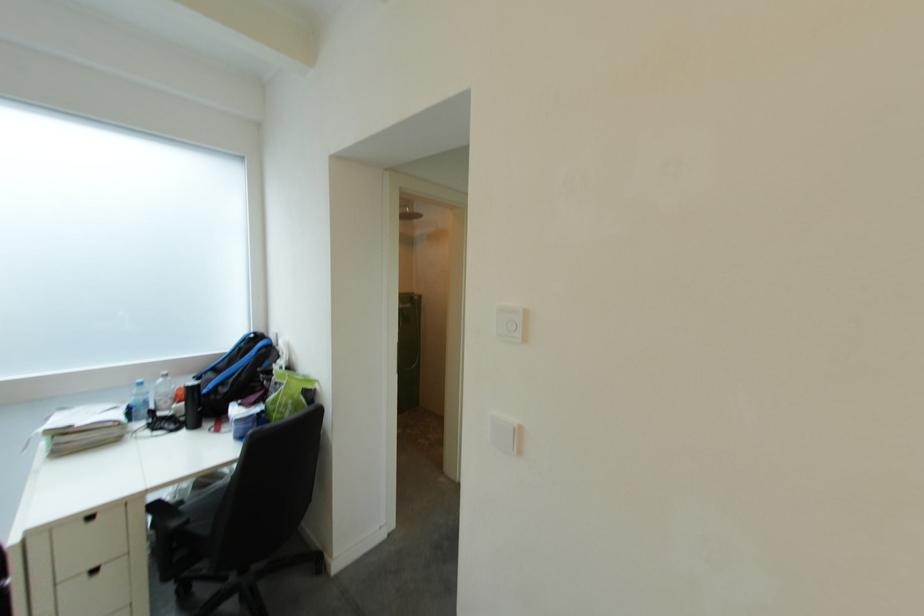
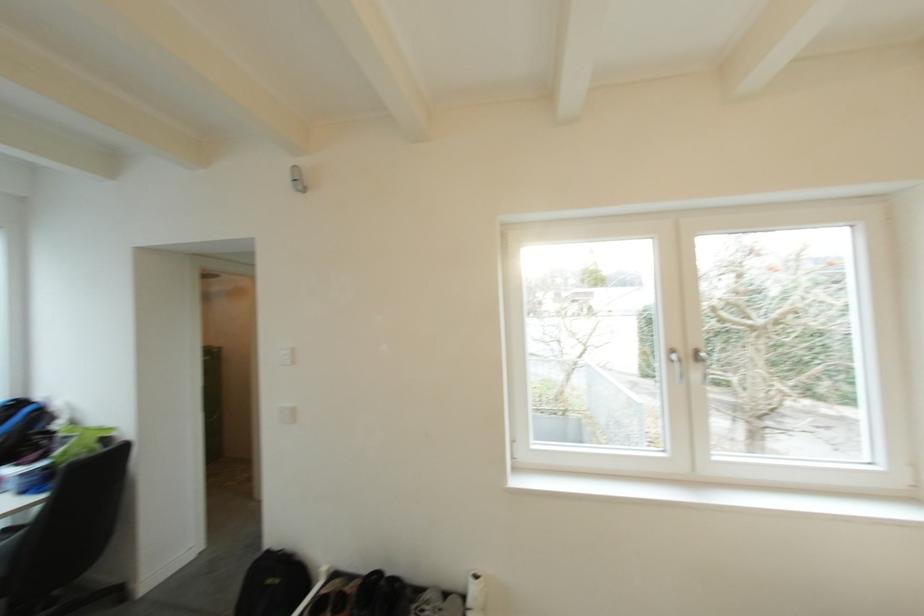
Find the pixel in the second image that matches point (265, 337) in the first image.

(29, 403)